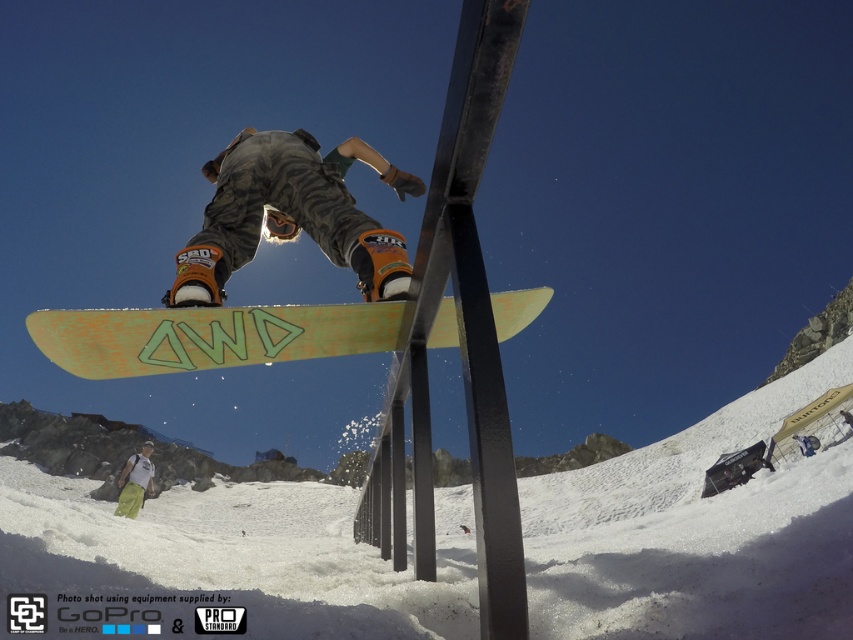
You are a photographer at the snowboarding event. You need to capture a photo where the camouflage pants at center and green fabric pants at lower left are both visible. Which pants should you focus on to ensure both are in the frame?

The camouflage pants at center is above green fabric pants at lower left, so focusing on the camouflage pants at center will ensure both are visible as the green fabric pants at lower left are below them.

You are a photographer standing at the camera position. You want to capture a closeup shot of the green matte snowboard at center. Considering the snowboard is 3.93 meters away, what is the minimum focal length required to fill the frame if your camera sensor has a diagonal of 24mm and the snowboard is 1.5 meters long?

The green matte snowboard at center is 3.93 meters from the camera and 1.5 meters long. Using the formula focal length needed is approximately sensor diagonal multiplied by subject size divided by distance. So 24mm diagonal sensor times 1.5m divided by 3.93m equals approximately 9.1mm. Therefore, a focal length of at least 9.1mm is required.